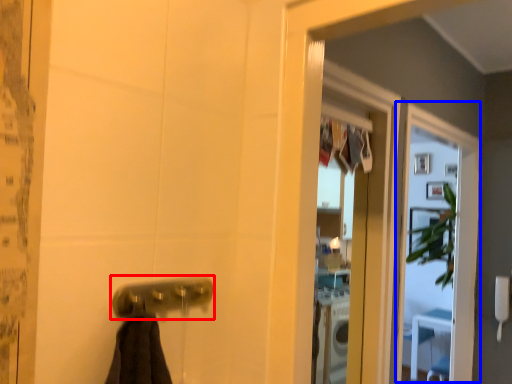
Question: Which of the following is the closest to the observer, door handle (highlighted by a red box) or screen door (highlighted by a blue box)?

Choices:
 (A) door handle
 (B) screen door

Answer: (A)